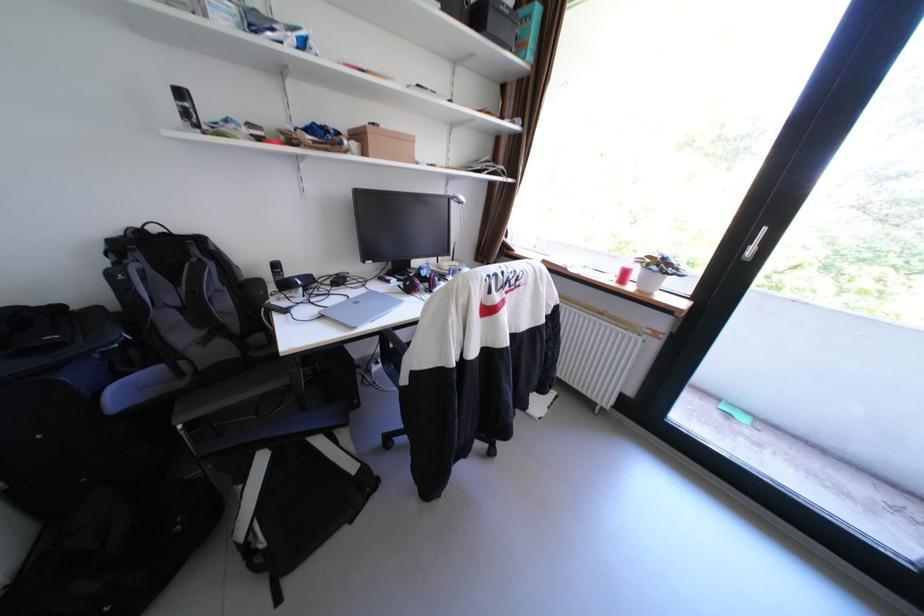
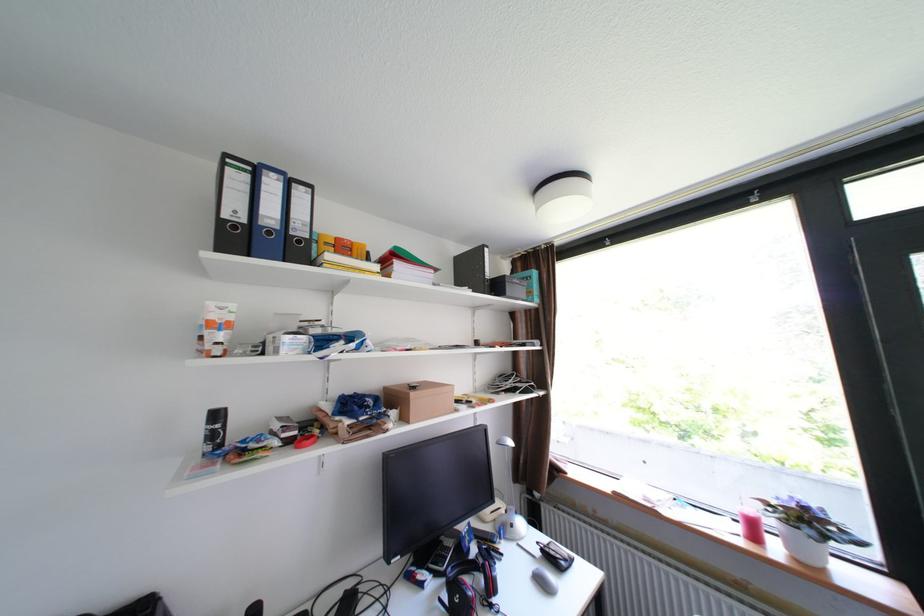
Locate, in the second image, the point that corresponds to the point at 199,116 in the first image.

(225, 436)